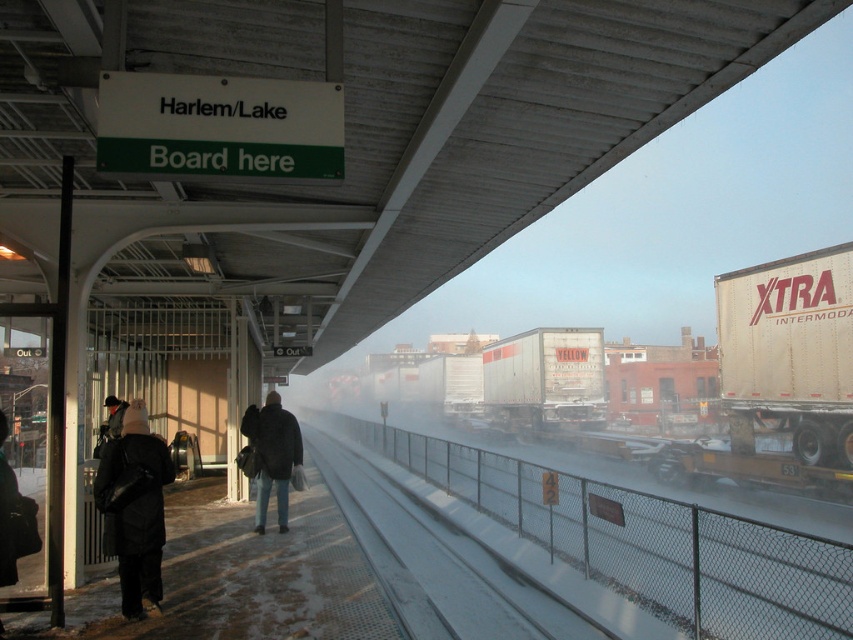
Question: Does black matte coat at left have a greater width compared to dark gray jacket at left?

Choices:
 (A) yes
 (B) no

Answer: (B)

Question: Based on their relative distances, which object is nearer to the black matte coat at lower left?

Choices:
 (A) yellow matte trailer truck at center
 (B) beige matte trailer truck at right
 (C) dark gray jacket at center
 (D) black matte coat at left

Answer: (D)

Question: Is beige matte trailer truck at right below dark gray jacket at center?

Choices:
 (A) yes
 (B) no

Answer: (B)

Question: Does black matte coat at lower left have a greater width compared to dark gray jacket at center?

Choices:
 (A) no
 (B) yes

Answer: (A)

Question: Which point appears farthest from the camera in this image?

Choices:
 (A) (489, 348)
 (B) (134, 616)
 (C) (109, 400)

Answer: (A)

Question: Which is farther from the beige matte trailer truck at right?

Choices:
 (A) black matte coat at left
 (B) black matte coat at lower left

Answer: (A)